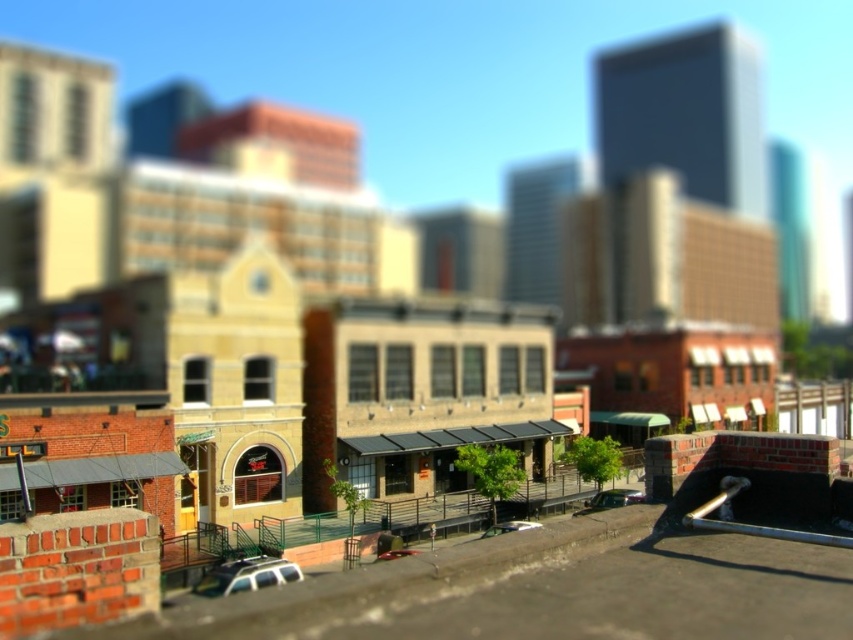
You are a delivery person who needs to park a 20 meter long truck between the white matte car at lower center and the satin black car at lower center. Is there enough space?

The white matte car at lower center is 19.54 meters away from the satin black car at lower center. Since the truck is 20 meters long, there isn not enough space to park the truck between them as the distance is slightly shorter than the truck.

You are standing on a rooftop overlooking the city. You spot two points in the scene, one at coordinates point (287, 564) and another at point (531, 525). Which point is nearer to your current position?

Point (287, 564) is closer to the viewer than point (531, 525), so the first point is nearer to your current position.